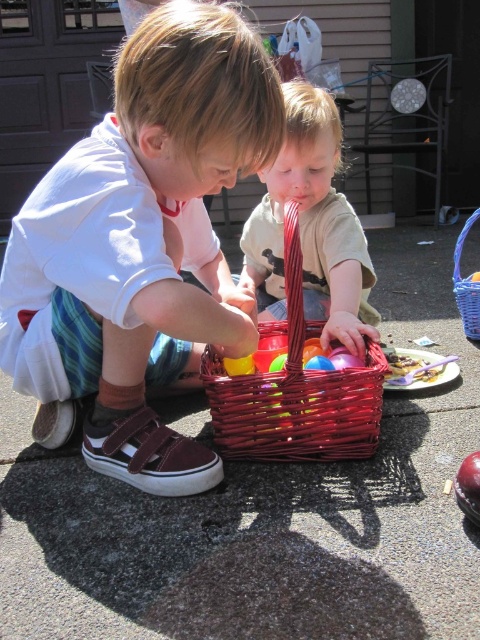
Question: Does matte white shirt at center have a lesser width compared to woven wicker basket at center?

Choices:
 (A) no
 (B) yes

Answer: (B)

Question: Estimate the real-world distances between objects in this image. Which object is farther from the matte plastic toddler at center?

Choices:
 (A) shiny metallic apple at lower right
 (B) matte white shirt at center
 (C) bright red wicker basket at center
 (D) woven wicker basket at center

Answer: (D)

Question: Can you confirm if bright red wicker basket at center is positioned to the right of woven wicker basket at center?

Choices:
 (A) no
 (B) yes

Answer: (A)

Question: Which point is farther from the camera taking this photo?

Choices:
 (A) (311, 212)
 (B) (330, 412)
 (C) (463, 292)

Answer: (C)

Question: Which object is closer to the camera taking this photo?

Choices:
 (A) matte plastic toddler at center
 (B) bright red wicker basket at center
 (C) woven wicker basket at center
 (D) matte white shirt at center

Answer: (D)

Question: Does bright red wicker basket at center have a greater width compared to shiny metallic apple at lower right?

Choices:
 (A) yes
 (B) no

Answer: (A)